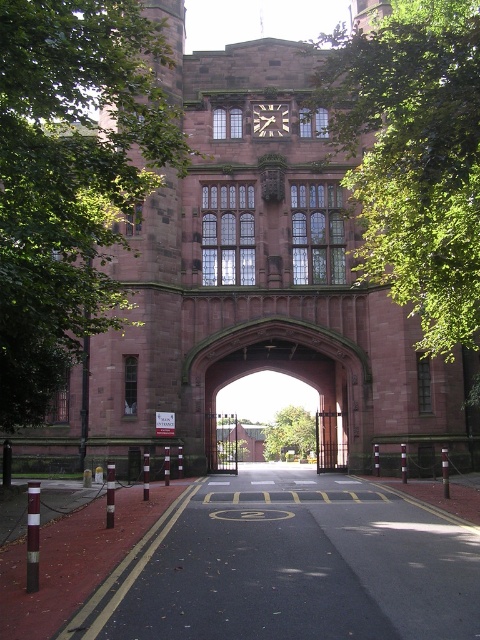
Question: Which point is farther to the camera?

Choices:
 (A) green leafy tree at center
 (B) smooth stone archway at center
 (C) green leafy tree at upper center
 (D) wooden clock at upper center

Answer: (A)

Question: From the image, what is the correct spatial relationship of green leafy tree at center in relation to wooden clock at upper center?

Choices:
 (A) left
 (B) right

Answer: (B)

Question: Observing the image, what is the correct spatial positioning of green leafy tree at upper center in reference to wooden clock at upper center?

Choices:
 (A) right
 (B) left

Answer: (A)

Question: Among these points, which one is farthest from the camera?

Choices:
 (A) (300, 428)
 (B) (363, 280)
 (C) (288, 326)
 (D) (257, 124)

Answer: (A)

Question: Does green leafy tree at upper center appear on the right side of green leafy tree at center?

Choices:
 (A) no
 (B) yes

Answer: (B)

Question: Based on their relative distances, which object is farther from the green leafy tree at upper center?

Choices:
 (A) green leafy tree at upper left
 (B) smooth stone archway at center
 (C) green leafy tree at center
 (D) wooden clock at upper center

Answer: (C)